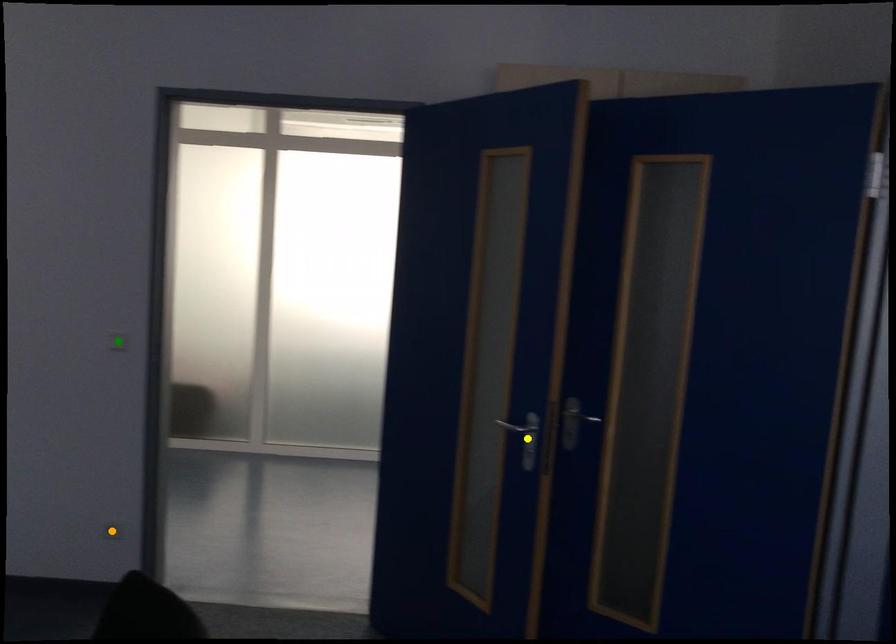
Order these from nearest to farthest:
orange point, green point, yellow point

orange point → green point → yellow point